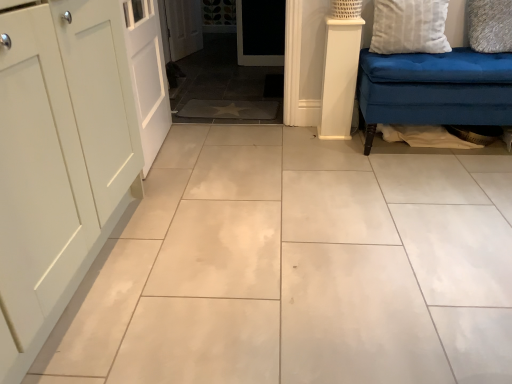
You are a GUI agent. You are given a task and a screenshot of the screen. Output one action in this format:
    pyautogui.click(x=<x>, y=<y>)
    Task: Click on the free point below white painted wood door at left (from a real-world perspective)
    Image resolution: width=512 pixels, height=384 pixels.
    Given the screenshot: What is the action you would take?
    pyautogui.click(x=162, y=146)